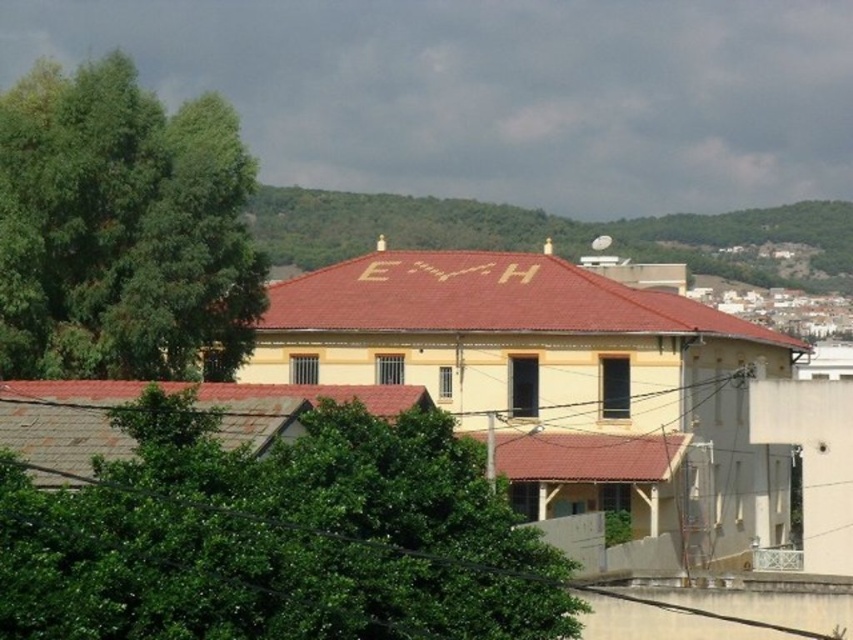
You are standing in front of the two story building and want to know which object is closer to the ground between the green leafy tree at lower left and the green leafy hillside at upper center. Which one is closer?

The green leafy tree at lower left is closer to the ground than the green leafy hillside at upper center because it is shorter.

You are standing in front of the two story building with the red roof. You notice a green leafy tree at left and a green leafy hillside at upper center. Which of these two objects is positioned higher up in the image?

The green leafy hillside at upper center is positioned higher up in the image than the green leafy tree at left.